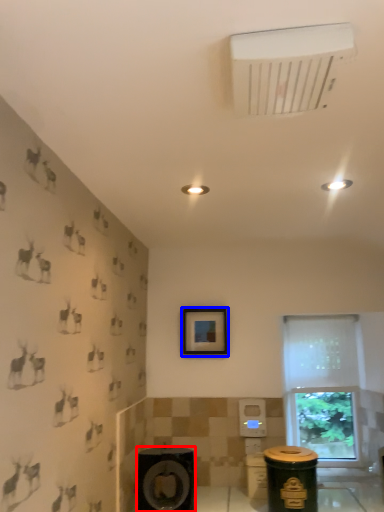
Question: Which object is closer to the camera taking this photo, speaker (highlighted by a red box) or picture frame (highlighted by a blue box)?

Choices:
 (A) speaker
 (B) picture frame

Answer: (A)